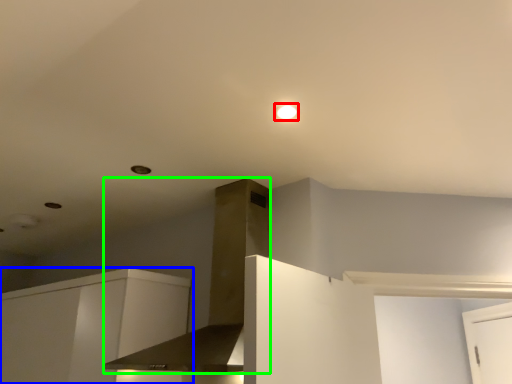
Question: Based on their relative distances, which object is nearer to lighting (highlighted by a red box)? Choose from cabinetry (highlighted by a blue box) and vent (highlighted by a green box).

Choices:
 (A) cabinetry
 (B) vent

Answer: (B)